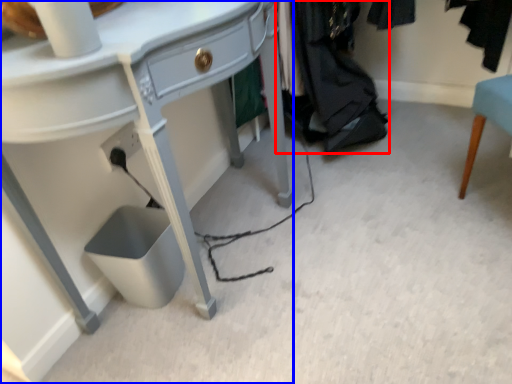
Question: Which of the following is the closest to the observer, clothing (highlighted by a red box) or desk (highlighted by a blue box)?

Choices:
 (A) clothing
 (B) desk

Answer: (B)